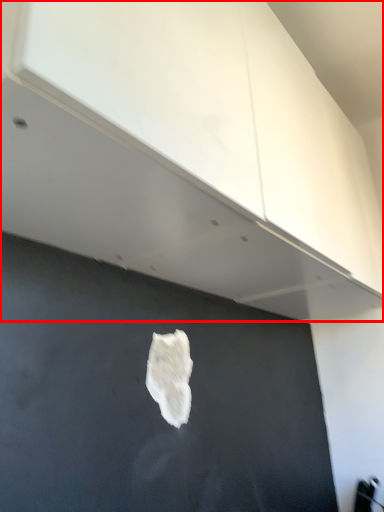
Question: In this image, where is cabinetry (annotated by the red box) located relative to patch?

Choices:
 (A) right
 (B) left

Answer: (A)